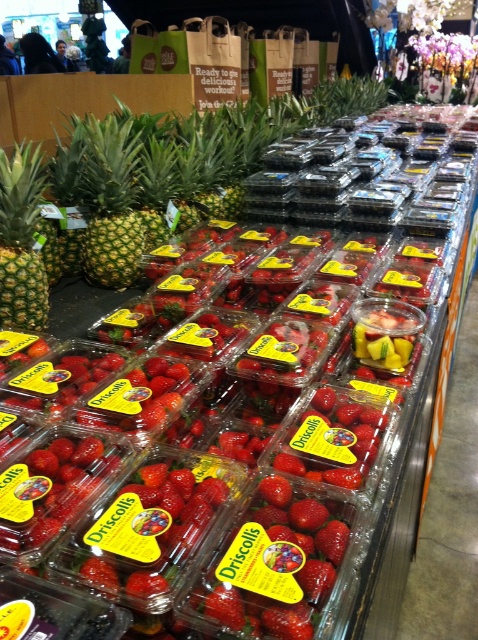
You are a grocery store employee tasked with arranging items. You have to place a new display of Driscoll strawberries in front of the pineapples. Based on the current layout, where should you position the strawberries relative to the green matte pineapple at left?

The green matte pineapple at left is located at point (110, 204), so you should position the strawberries in front of this location to maintain the current layout.

You are standing in the produce section of a grocery store. You see a point marked at coordinates (x=110, y=204). What object is located at that point?

The point at coordinates (x=110, y=204) marks the location of the green matte pineapple at left.

You are a grocery store employee who needs to place a 5.5 feet long ladder in the produce section. The ladder must be placed between the green matte pineapple at left and the nearest wall. Can you fit the ladder there?

The green matte pineapple at left is 5.32 feet from the camera, so the distance between the pineapple and the nearest wall is unknown. Without knowing the total space available, it is impossible to determine if the ladder will fit.